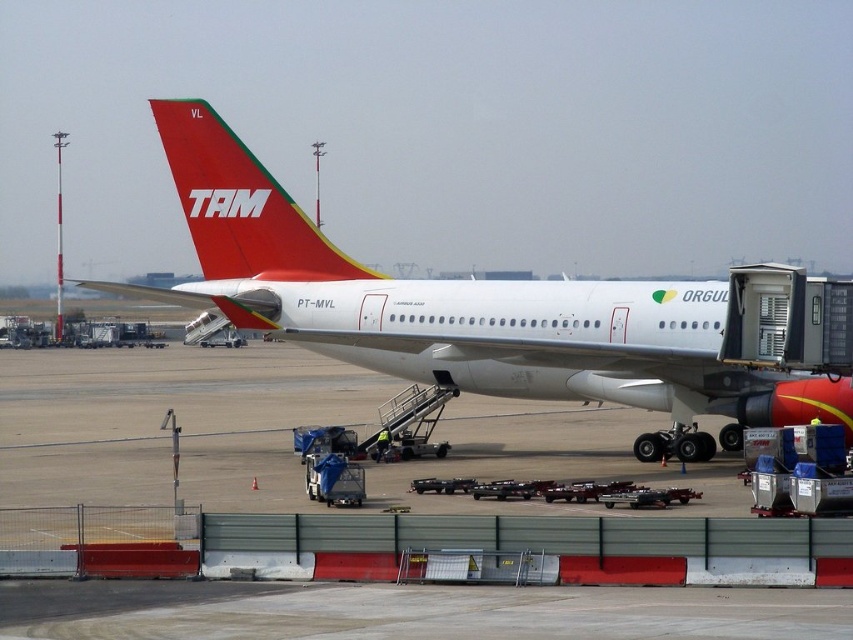
You are a pilot preparing for takeoff and need to check the aircraft size relative to the jet bridge. Which object in the scene is bigger, the white glossy airplane at center or the matte red airplane tail at upper center?

The white glossy airplane at center is larger in size compared to the matte red airplane tail at upper center, so the airplane is bigger than the tail section.